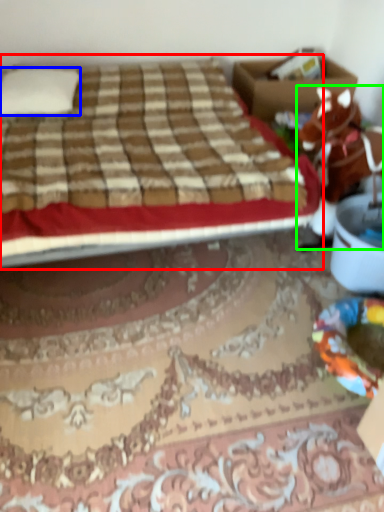
Question: Which object is positioned closest to bed (highlighted by a red box)? Select from pillow (highlighted by a blue box) and animal (highlighted by a green box).

Choices:
 (A) pillow
 (B) animal

Answer: (A)